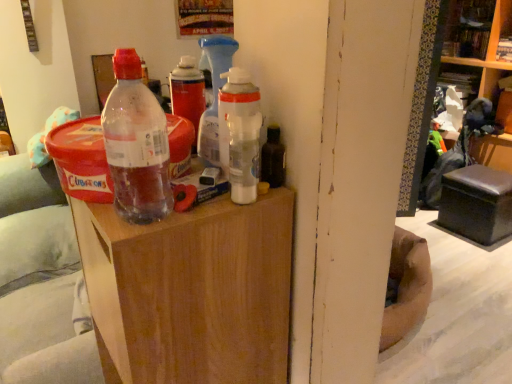
Question: Is translucent plastic bottle at center closer to camera compared to wooden bookshelf at upper right, the second shelf ordered from the bottom?

Choices:
 (A) no
 (B) yes

Answer: (B)

Question: Can you confirm if translucent plastic bottle at center is thinner than wooden bookshelf at upper right, the 1th shelf from the top?

Choices:
 (A) no
 (B) yes

Answer: (B)

Question: From the image's perspective, is translucent plastic bottle at center beneath wooden bookshelf at upper right, the second shelf ordered from the bottom?

Choices:
 (A) no
 (B) yes

Answer: (B)

Question: Would you say translucent plastic bottle at center is outside wooden bookshelf at upper right, the second shelf ordered from the bottom?

Choices:
 (A) yes
 (B) no

Answer: (A)

Question: Can you confirm if translucent plastic bottle at center is positioned to the left of wooden bookshelf at upper right, the 1th shelf from the top?

Choices:
 (A) yes
 (B) no

Answer: (A)

Question: Is translucent plastic bottle at center positioned far away from wooden bookshelf at upper right, the second shelf ordered from the bottom?

Choices:
 (A) yes
 (B) no

Answer: (A)

Question: Is translucent plastic bottle at center aimed at wooden side table at center?

Choices:
 (A) yes
 (B) no

Answer: (B)

Question: Would you say translucent plastic bottle at center is a long distance from wooden side table at center?

Choices:
 (A) yes
 (B) no

Answer: (B)

Question: From the image's perspective, does translucent plastic bottle at center appear higher than wooden side table at center?

Choices:
 (A) no
 (B) yes

Answer: (B)

Question: Can you confirm if translucent plastic bottle at center is positioned to the right of wooden side table at center?

Choices:
 (A) no
 (B) yes

Answer: (A)

Question: Can wooden side table at center be found inside translucent plastic bottle at center?

Choices:
 (A) yes
 (B) no

Answer: (B)

Question: Can you confirm if translucent plastic bottle at center is bigger than wooden side table at center?

Choices:
 (A) no
 (B) yes

Answer: (A)

Question: Can you confirm if wooden bookshelf at upper right, the second shelf ordered from the bottom, is positioned to the right of wooden bookshelf at upper right, the 2th shelf viewed from the top?

Choices:
 (A) no
 (B) yes

Answer: (A)